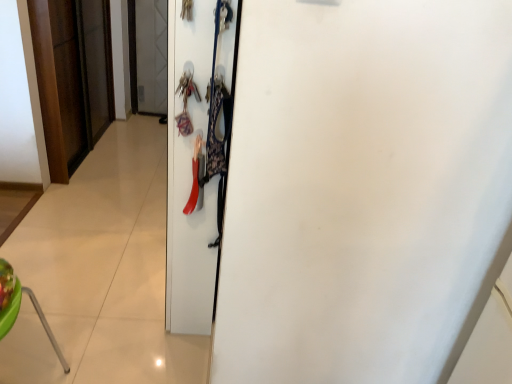
Find the location of a particular element. This screenshot has width=512, height=384. vacant area that lies in front of white matte door at center, which is the first door in right-to-left order is located at coordinates (145, 348).